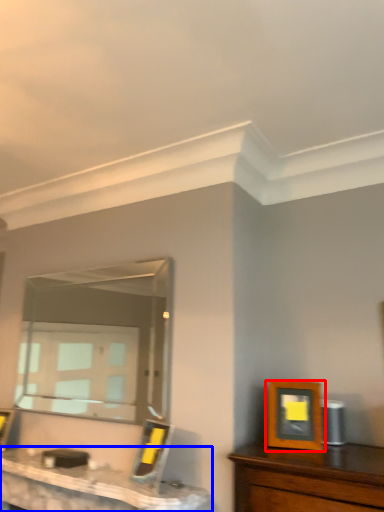
Question: Which of the following is the farthest to the observer, picture frame (highlighted by a red box) or table (highlighted by a blue box)?

Choices:
 (A) picture frame
 (B) table

Answer: (A)